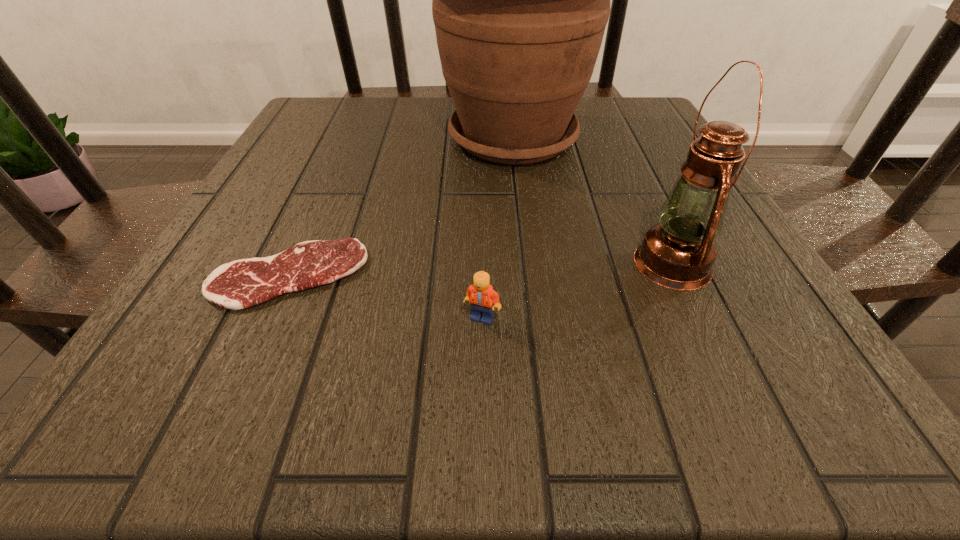
I want to click on object present at the left edge, so click(x=243, y=283).

Where is `object located in the right edge section of the desktop`? This screenshot has height=540, width=960. object located in the right edge section of the desktop is located at coordinates (678, 253).

Where is `vacant space at the far edge`? This screenshot has height=540, width=960. vacant space at the far edge is located at coordinates (585, 100).

Image resolution: width=960 pixels, height=540 pixels. In the image, there is a desktop. In order to click on vacant space at the near edge in this screenshot , I will do `click(469, 375)`.

Locate an element on the screen. vacant space at the left edge is located at coordinates (282, 150).

Locate an element on the screen. vacant space at the right edge of the desktop is located at coordinates (609, 150).

In the image, there is a desktop. At what (x,y) coordinates should I click in order to perform the action: click on blank space at the far left corner. Please return your answer as a coordinate pair (x, y). Looking at the image, I should click on (366, 118).

Identify the location of free space at the near left corner. (153, 394).

What are the coordinates of `vacant area at the far right corner` in the screenshot? It's located at (620, 133).

This screenshot has width=960, height=540. Identify the location of vacant space that is in between the flowerpot and the oil lamp. (593, 201).